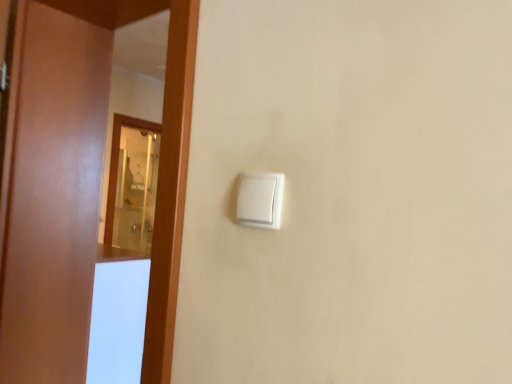
Describe the element at coordinates (260, 200) in the screenshot. I see `white plastic light switch at center` at that location.

What are the coordinates of `white plastic light switch at center` in the screenshot? It's located at (260, 200).

What is the approximate height of white plastic light switch at center?

The height of white plastic light switch at center is 3.26 inches.

Locate an element on the screen. The image size is (512, 384). white plastic light switch at center is located at coordinates (260, 200).